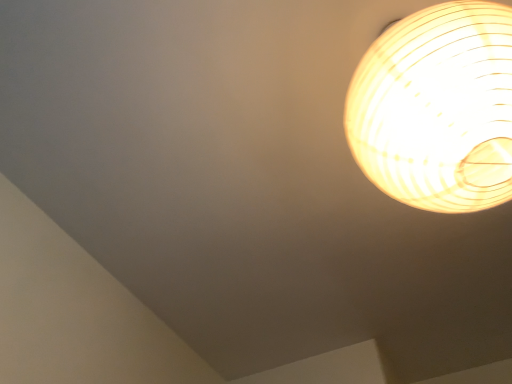
What do you see at coordinates (437, 108) in the screenshot?
I see `ivory woven lampshade at upper right` at bounding box center [437, 108].

Identify the location of ivory woven lampshade at upper right. (437, 108).

Identify the location of ivory woven lampshade at upper right. The width and height of the screenshot is (512, 384). (437, 108).